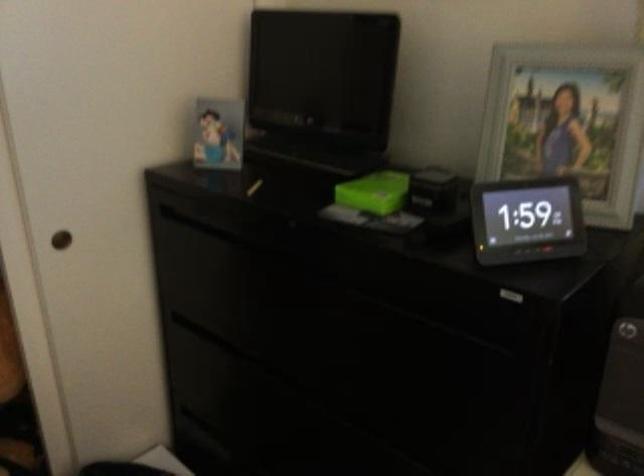
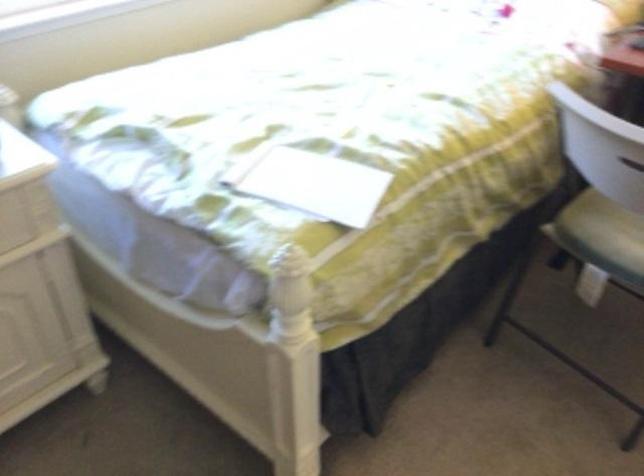
How did the camera likely rotate?

The rotation direction of the camera is right-down.